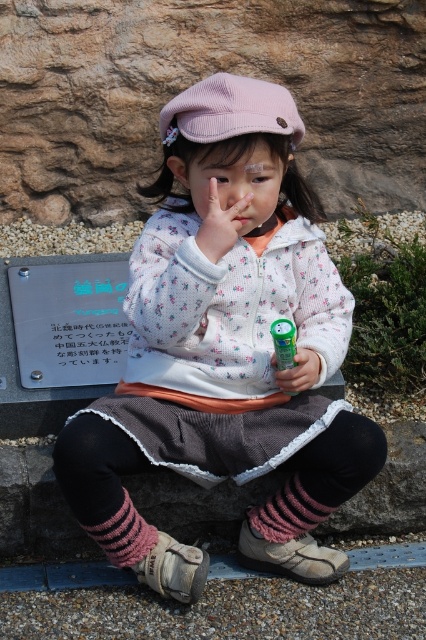
Question: Which point is closer to the camera?

Choices:
 (A) (276, 516)
 (B) (316, 364)
 (C) (216, 198)

Answer: (C)

Question: Based on their relative distances, which object is farther from the pink corduroy cap at upper center?

Choices:
 (A) knitted pink sock at lower center
 (B) matte pink hand at center
 (C) green plastic can at center
 (D) green matte toy at center

Answer: (A)

Question: Is fluffy pink beret at center closer to the viewer compared to pink knitted sock at lower left?

Choices:
 (A) yes
 (B) no

Answer: (A)

Question: Which of the following is the closest to the observer?

Choices:
 (A) pink corduroy cap at upper center
 (B) green plastic can at center
 (C) pink knitted sock at lower left
 (D) knitted pink sock at lower center

Answer: (A)

Question: Can you confirm if matte pink hand at center is wider than green matte toy at center?

Choices:
 (A) no
 (B) yes

Answer: (B)

Question: Considering the relative positions of fluffy pink beret at center and knitted pink sock at lower center in the image provided, where is fluffy pink beret at center located with respect to knitted pink sock at lower center?

Choices:
 (A) left
 (B) right

Answer: (A)